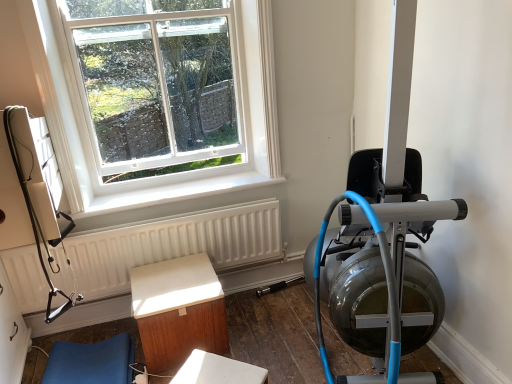
Describe the element at coordinates (178, 310) in the screenshot. I see `light brown wood table at center, the first furniture when ordered from right to left` at that location.

Identify the location of light brown wood table at center, the first furniture when ordered from right to left. The image size is (512, 384). [x=178, y=310].

Image resolution: width=512 pixels, height=384 pixels. What do you see at coordinates (91, 362) in the screenshot? I see `blue fabric cushion at lower left, the 2th furniture from the right` at bounding box center [91, 362].

Where is `blue rubber rowing machine at right`? The width and height of the screenshot is (512, 384). blue rubber rowing machine at right is located at coordinates (379, 268).

What is the approximate width of white glass window at upper left?

8.11 centimeters.

Where is `light brown wood table at center, acting as the 2th furniture starting from the left`? light brown wood table at center, acting as the 2th furniture starting from the left is located at coordinates (178, 310).

From a real-world perspective, is white matte radiator at lower center on light brown wood table at center, the first furniture when ordered from right to left?

Indeed, from a real-world perspective, white matte radiator at lower center stands above light brown wood table at center, the first furniture when ordered from right to left.

Looking at their sizes, would you say white matte radiator at lower center is wider or thinner than light brown wood table at center, acting as the 2th furniture starting from the left?

In the image, white matte radiator at lower center appears to be more narrow than light brown wood table at center, acting as the 2th furniture starting from the left.

Can you confirm if white matte radiator at lower center is smaller than light brown wood table at center, acting as the 2th furniture starting from the left?

Indeed, white matte radiator at lower center has a smaller size compared to light brown wood table at center, acting as the 2th furniture starting from the left.

Is white matte table at lower center further to camera compared to light brown wood table at center, the first furniture when ordered from right to left?

No, white matte table at lower center is closer to the viewer.

In terms of size, does white matte table at lower center appear bigger or smaller than light brown wood table at center, acting as the 2th furniture starting from the left?

white matte table at lower center is smaller than light brown wood table at center, acting as the 2th furniture starting from the left.

Considering the relative positions of white matte table at lower center and light brown wood table at center, the first furniture when ordered from right to left, in the image provided, is white matte table at lower center to the left or to the right of light brown wood table at center, the first furniture when ordered from right to left,?

In the image, white matte table at lower center appears on the right side of light brown wood table at center, the first furniture when ordered from right to left.

Is white glass window at upper left outside of blue rubber rowing machine at right?

That's correct, white glass window at upper left is outside of blue rubber rowing machine at right.

From the image's perspective, which one is positioned higher, white glass window at upper left or blue rubber rowing machine at right?

white glass window at upper left is shown above in the image.

The width and height of the screenshot is (512, 384). I want to click on window on the left of blue rubber rowing machine at right, so click(165, 100).

Which is closer, (104, 86) or (105, 361)?

Point (104, 86) appears to be farther away from the viewer than point (105, 361).

Between white glass window at upper left and blue fabric cushion at lower left, the 2th furniture from the right, which one has smaller size?

blue fabric cushion at lower left, the 2th furniture from the right.

Would you say white glass window at upper left is inside or outside blue fabric cushion at lower left, placed as the first furniture when sorted from left to right?

white glass window at upper left is spatially situated outside blue fabric cushion at lower left, placed as the first furniture when sorted from left to right.

From a real-world perspective, starting from the white glass window at upper left, which furniture is the 2nd one below it? Please provide its 2D coordinates.

[(91, 362)]

Is blue fabric cushion at lower left, the 2th furniture from the right, oriented towards blue rubber rowing machine at right?

No, blue fabric cushion at lower left, the 2th furniture from the right, is not facing towards blue rubber rowing machine at right.

From a real-world perspective, is blue fabric cushion at lower left, the 2th furniture from the right, positioned above or below blue rubber rowing machine at right?

Clearly, from a real-world perspective, blue fabric cushion at lower left, the 2th furniture from the right, is below blue rubber rowing machine at right.

Considering the points (95, 345) and (377, 369), which point is in front, point (95, 345) or point (377, 369)?

The point (377, 369) is closer.

Does point (384, 376) appear closer or farther from the camera than point (92, 76)?

Point (384, 376) is positioned closer to the camera compared to point (92, 76).

Is blue rubber rowing machine at right wider than white glass window at upper left?

Yes.

From a real-world perspective, is blue rubber rowing machine at right positioned under white glass window at upper left based on gravity?

Yes, from a real-world perspective, blue rubber rowing machine at right is beneath white glass window at upper left.

Is blue rubber rowing machine at right beside white glass window at upper left?

No, blue rubber rowing machine at right is not touching white glass window at upper left.

Considering the positions of objects white matte radiator at lower center and blue rubber rowing machine at right in the image provided, who is more to the right, white matte radiator at lower center or blue rubber rowing machine at right?

blue rubber rowing machine at right.

Is white matte radiator at lower center taller than blue rubber rowing machine at right?

In fact, white matte radiator at lower center may be shorter than blue rubber rowing machine at right.

Which is closer, (x=193, y=227) or (x=400, y=316)?

The point (x=400, y=316) is closer to the camera.

Considering the sizes of white matte radiator at lower center and blue rubber rowing machine at right in the image, is white matte radiator at lower center wider or thinner than blue rubber rowing machine at right?

In the image, white matte radiator at lower center appears to be more narrow than blue rubber rowing machine at right.

Starting from the white matte radiator at lower center, which furniture is the 1st one in front? Please provide its 2D coordinates.

[(178, 310)]

From the white matte table at lower center, count the 1st furniture to the left and point to it. Please provide its 2D coordinates.

[(178, 310)]

Considering their positions, is white glass window at upper left positioned closer to light brown wood table at center, the first furniture when ordered from right to left, than blue rubber rowing machine at right?

The object closer to light brown wood table at center, the first furniture when ordered from right to left, is white glass window at upper left.

Based on their spatial positions, is light brown wood table at center, acting as the 2th furniture starting from the left, or blue fabric cushion at lower left, placed as the first furniture when sorted from left to right, closer to blue rubber rowing machine at right?

light brown wood table at center, acting as the 2th furniture starting from the left, is closer to blue rubber rowing machine at right.

Estimate the real-world distances between objects in this image. Which object is closer to white matte table at lower center, blue fabric cushion at lower left, placed as the first furniture when sorted from left to right, or light brown wood table at center, acting as the 2th furniture starting from the left?

light brown wood table at center, acting as the 2th furniture starting from the left.

Consider the image. When comparing their distances from white glass window at upper left, does blue fabric cushion at lower left, placed as the first furniture when sorted from left to right, or light brown wood table at center, the first furniture when ordered from right to left, seem further?

blue fabric cushion at lower left, placed as the first furniture when sorted from left to right, lies further to white glass window at upper left than the other object.

Which object lies further to the anchor point blue rubber rowing machine at right, light brown wood table at center, acting as the 2th furniture starting from the left, or white glass window at upper left?

white glass window at upper left.

Looking at the image, which one is located further to blue rubber rowing machine at right, white matte radiator at lower center or light brown wood table at center, acting as the 2th furniture starting from the left?

white matte radiator at lower center.

From the image, which object appears to be farther from white glass window at upper left, white matte radiator at lower center or blue rubber rowing machine at right?

blue rubber rowing machine at right lies further to white glass window at upper left than the other object.

When comparing their distances from white glass window at upper left, does light brown wood table at center, acting as the 2th furniture starting from the left, or blue rubber rowing machine at right seem closer?

light brown wood table at center, acting as the 2th furniture starting from the left, is positioned closer to the anchor white glass window at upper left.

Where is `radiator between white glass window at upper left and white matte table at lower center from top to bottom`? radiator between white glass window at upper left and white matte table at lower center from top to bottom is located at coordinates (175, 244).

The image size is (512, 384). I want to click on furniture between white matte radiator at lower center and blue fabric cushion at lower left, placed as the first furniture when sorted from left to right, in the up-down direction, so click(x=178, y=310).

The image size is (512, 384). I want to click on radiator between white glass window at upper left and light brown wood table at center, acting as the 2th furniture starting from the left, in the vertical direction, so (x=175, y=244).

Identify the location of radiator between white glass window at upper left and blue fabric cushion at lower left, the 2th furniture from the right, in the vertical direction. (175, 244).